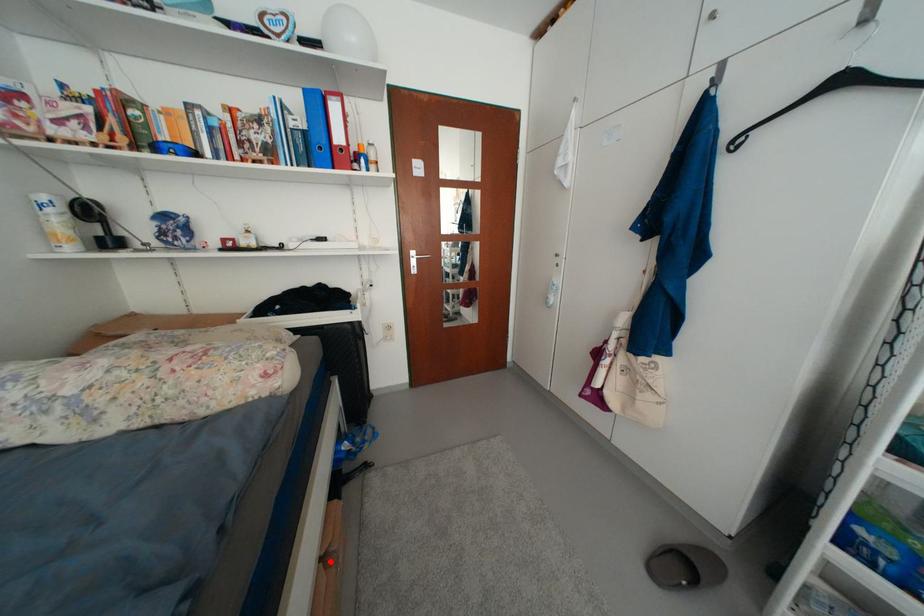
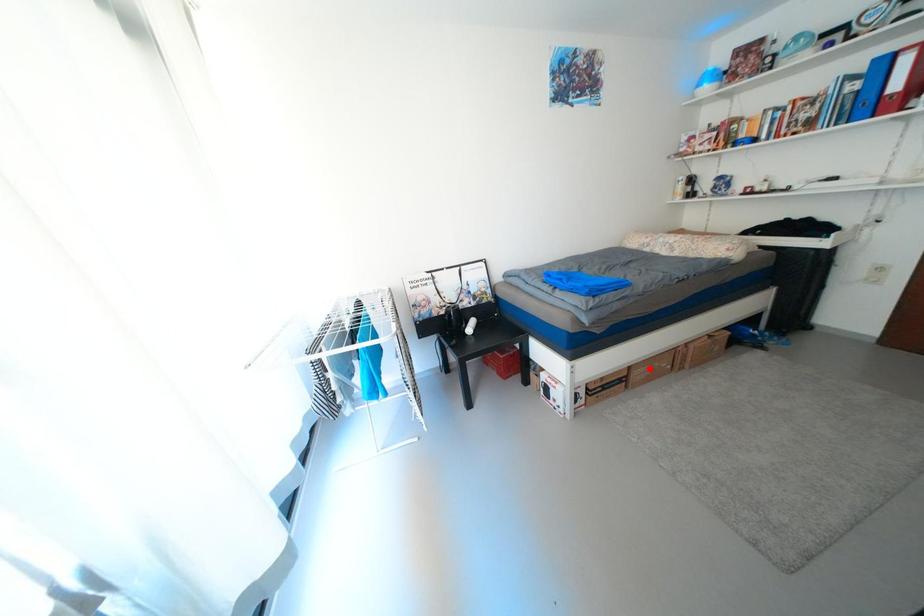
I am providing you with two images of the same scene from different viewpoints. A red point is marked on the first image and another point is marked on the second image. Is the marked point in image1 the same physical position as the marked point in image2?

No